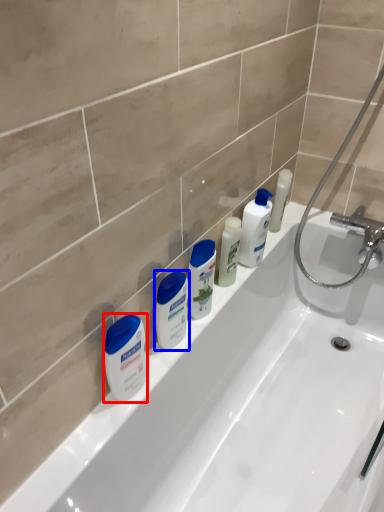
Question: Which point is further to the camera, cleaning product (highlighted by a red box) or toiletry (highlighted by a blue box)?

Choices:
 (A) cleaning product
 (B) toiletry

Answer: (B)